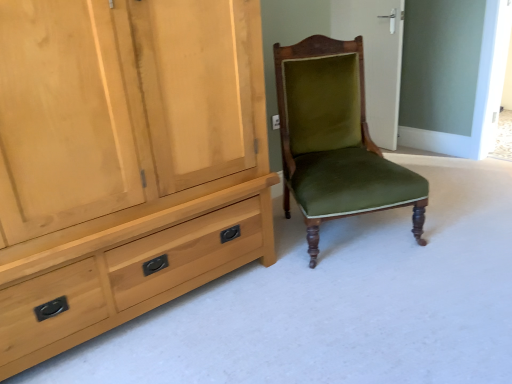
Question: Does light wood cabinet at left appear on the right side of velvet green chair at center?

Choices:
 (A) yes
 (B) no

Answer: (B)

Question: Is light wood cabinet at left closer to camera compared to velvet green chair at center?

Choices:
 (A) yes
 (B) no

Answer: (A)

Question: Considering the relative sizes of light wood cabinet at left and velvet green chair at center in the image provided, is light wood cabinet at left wider than velvet green chair at center?

Choices:
 (A) yes
 (B) no

Answer: (B)

Question: Is light wood cabinet at left thinner than velvet green chair at center?

Choices:
 (A) no
 (B) yes

Answer: (B)

Question: Considering the relative sizes of light wood cabinet at left and velvet green chair at center in the image provided, is light wood cabinet at left smaller than velvet green chair at center?

Choices:
 (A) no
 (B) yes

Answer: (A)

Question: From the image's perspective, is green velvet chair at center positioned above or below light wood cabinet at left?

Choices:
 (A) above
 (B) below

Answer: (A)

Question: Based on their sizes in the image, would you say green velvet chair at center is bigger or smaller than light wood cabinet at left?

Choices:
 (A) big
 (B) small

Answer: (B)

Question: Considering the positions of point (399, 67) and point (31, 13), is point (399, 67) closer or farther from the camera than point (31, 13)?

Choices:
 (A) closer
 (B) farther

Answer: (B)

Question: In terms of width, does green velvet chair at center look wider or thinner when compared to light wood cabinet at left?

Choices:
 (A) wide
 (B) thin

Answer: (B)

Question: Is point (294, 66) closer or farther from the camera than point (359, 6)?

Choices:
 (A) closer
 (B) farther

Answer: (A)

Question: From a real-world perspective, is velvet green chair at center physically located above or below green velvet chair at center?

Choices:
 (A) below
 (B) above

Answer: (A)

Question: From the image's perspective, is velvet green chair at center above or below green velvet chair at center?

Choices:
 (A) above
 (B) below

Answer: (B)

Question: In the image, is velvet green chair at center positioned in front of or behind green velvet chair at center?

Choices:
 (A) front
 (B) behind

Answer: (A)

Question: Is point (181, 49) positioned closer to the camera than point (316, 182)?

Choices:
 (A) farther
 (B) closer

Answer: (B)

Question: From the image's perspective, is light wood cabinet at left positioned above or below velvet green chair at center?

Choices:
 (A) below
 (B) above

Answer: (A)